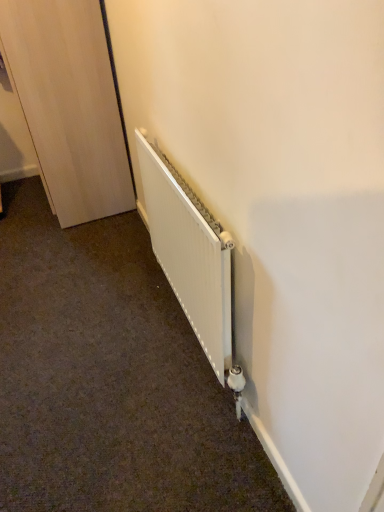
Question: Can you confirm if white matte radiator at lower center is thinner than light wood door at left?

Choices:
 (A) yes
 (B) no

Answer: (A)

Question: Is the position of white matte radiator at lower center more distant than that of light wood door at left?

Choices:
 (A) yes
 (B) no

Answer: (B)

Question: Is white matte radiator at lower center at the left side of light wood door at left?

Choices:
 (A) yes
 (B) no

Answer: (B)

Question: From the image's perspective, does white matte radiator at lower center appear lower than light wood door at left?

Choices:
 (A) no
 (B) yes

Answer: (B)

Question: Can we say white matte radiator at lower center lies outside light wood door at left?

Choices:
 (A) yes
 (B) no

Answer: (A)

Question: From a real-world perspective, is white matte radiator at lower center located beneath light wood door at left?

Choices:
 (A) yes
 (B) no

Answer: (A)

Question: Considering the relative sizes of light wood door at left and white matte radiator at lower center in the image provided, is light wood door at left wider than white matte radiator at lower center?

Choices:
 (A) yes
 (B) no

Answer: (A)

Question: From the image's perspective, is light wood door at left beneath white matte radiator at lower center?

Choices:
 (A) no
 (B) yes

Answer: (A)

Question: Is light wood door at left directly adjacent to white matte radiator at lower center?

Choices:
 (A) no
 (B) yes

Answer: (A)

Question: From the image's perspective, is light wood door at left on top of white matte radiator at lower center?

Choices:
 (A) yes
 (B) no

Answer: (A)

Question: Can you confirm if light wood door at left is positioned to the right of white matte radiator at lower center?

Choices:
 (A) no
 (B) yes

Answer: (A)

Question: Are light wood door at left and white matte radiator at lower center located far from each other?

Choices:
 (A) no
 (B) yes

Answer: (A)

Question: From the image's perspective, is light wood door at left above or below white matte radiator at lower center?

Choices:
 (A) below
 (B) above

Answer: (B)